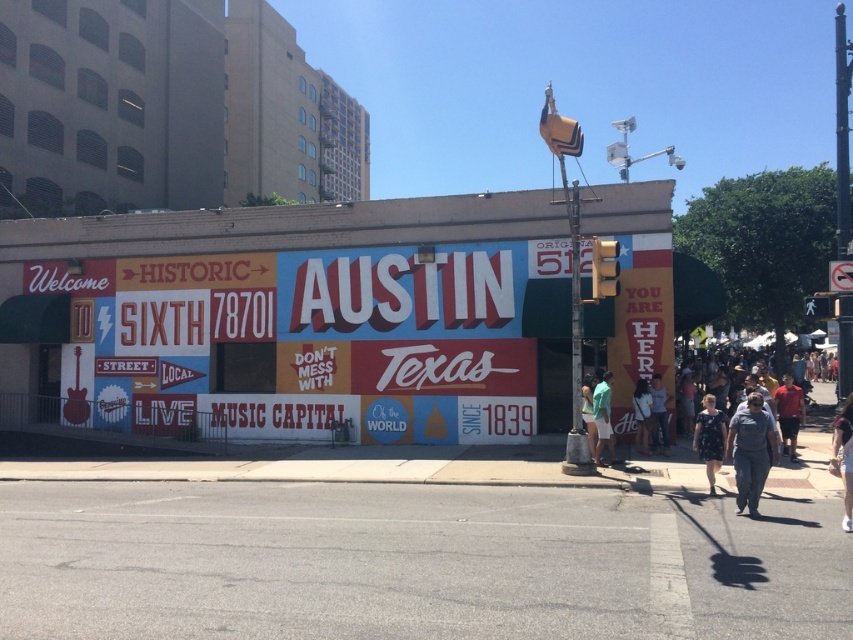
Based on the photo, you are standing in front of the mural and want to touch both the matte painted sign at center and the green fabric shorts at lower right. Which object will require you to move forward more to reach?

The green fabric shorts at lower right will require moving forward more because the matte painted sign at center is closer to the viewer than the green fabric shorts at lower right.

You are a fashion designer observing a person wearing green fabric shorts at lower right and a white fabric shirt at lower right. Which clothing item might have a larger width measurement?

The green fabric shorts at lower right might be wider than the white fabric shirt at lower right.